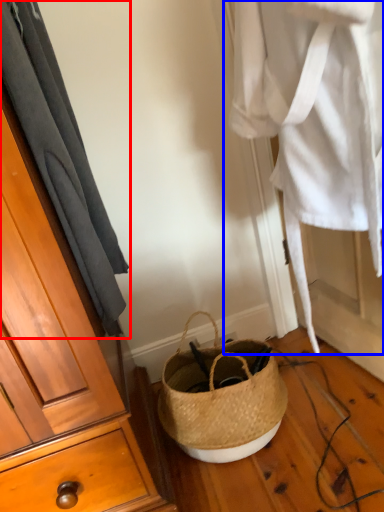
Question: Among these objects, which one is farthest to the camera, curtain (highlighted by a red box) or clothing (highlighted by a blue box)?

Choices:
 (A) curtain
 (B) clothing

Answer: (B)